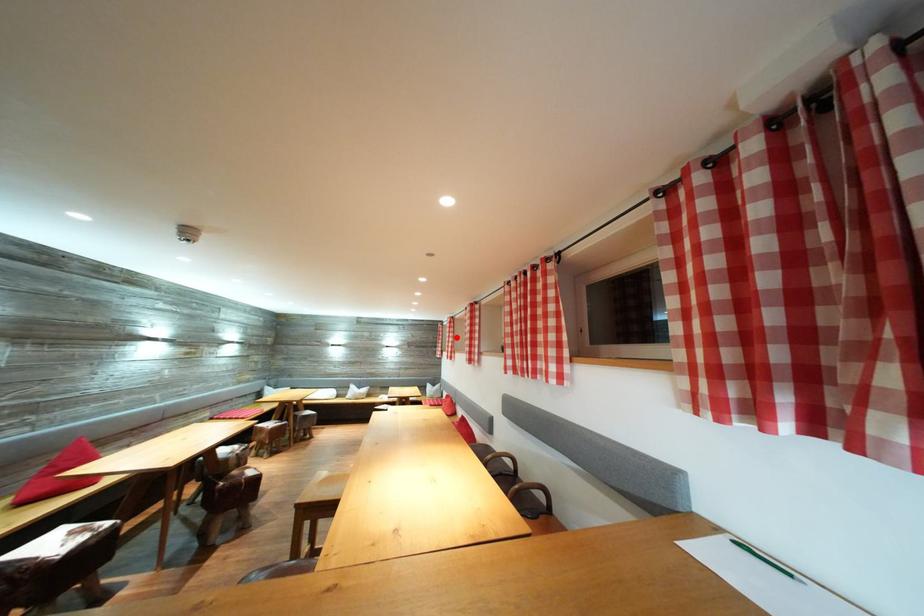
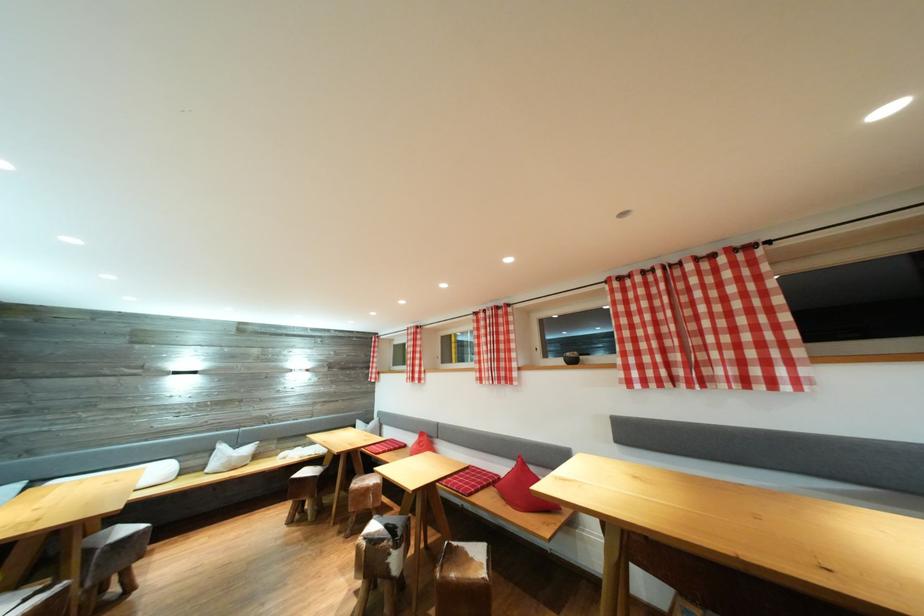
Find the pixel in the second image that matches the highlighted location in the first image.

(421, 351)